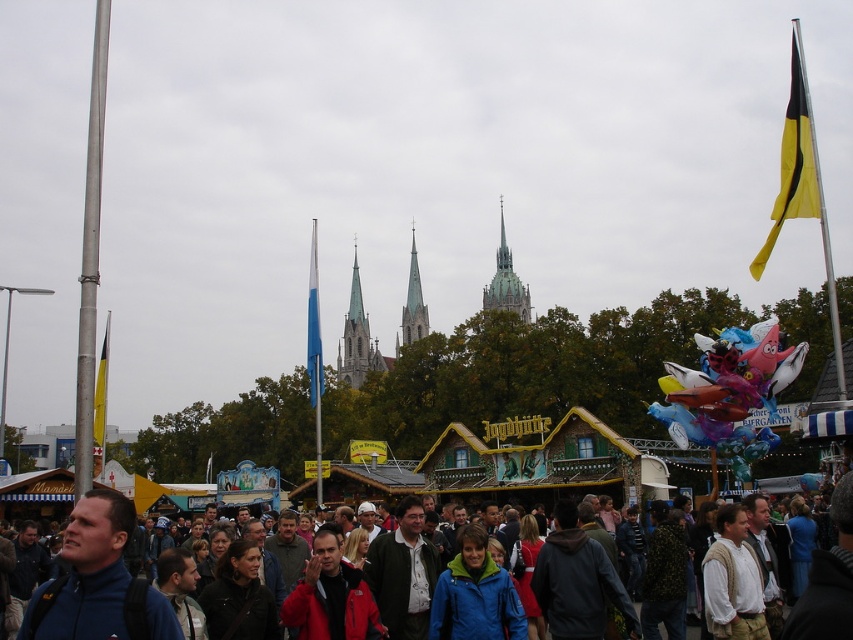
Question: Which object is farther from the camera taking this photo?

Choices:
 (A) multicolored fabric crowd at center
 (B) green stone tower at center

Answer: (B)

Question: Does yellow fabric flag at upper right have a larger size compared to smooth gray stone tower at center?

Choices:
 (A) no
 (B) yes

Answer: (B)

Question: Does smooth gray stone tower at center have a lesser width compared to blue fabric flag at center?

Choices:
 (A) no
 (B) yes

Answer: (B)

Question: Which object appears closest to the camera in this image?

Choices:
 (A) smooth gray stone tower at center
 (B) blue fabric flag at center

Answer: (B)

Question: Can you confirm if multicolored fabric crowd at center is positioned to the left of blue fabric flag at center?

Choices:
 (A) no
 (B) yes

Answer: (A)

Question: Among these objects, which one is farthest from the camera?

Choices:
 (A) smooth gray stone tower at center
 (B) yellow fabric flag at left

Answer: (A)